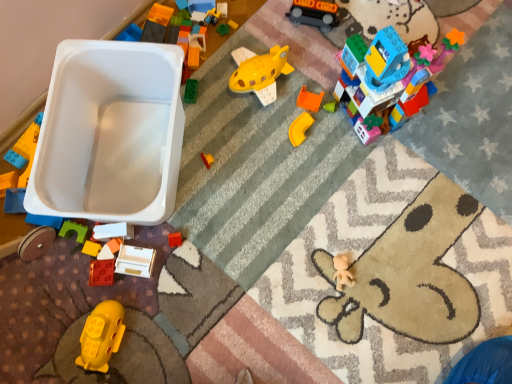
Question: Considering the relative sizes of white plastic toy car at upper left and multicolored plastic building block at upper right, which is the eighth toy in left-to-right order, in the image provided, is white plastic toy car at upper left bigger than multicolored plastic building block at upper right, which is the eighth toy in left-to-right order,?

Choices:
 (A) no
 (B) yes

Answer: (B)

Question: Does white plastic toy car at upper left lie in front of multicolored plastic building block at upper right, which appears as the seventh toy when ordered from the bottom?

Choices:
 (A) no
 (B) yes

Answer: (A)

Question: Is white plastic toy car at upper left wider than multicolored plastic building block at upper right, which appears as the seventh toy when ordered from the bottom?

Choices:
 (A) no
 (B) yes

Answer: (B)

Question: From a real-world perspective, is white plastic toy car at upper left on top of multicolored plastic building block at upper right, which is the eighth toy in left-to-right order?

Choices:
 (A) no
 (B) yes

Answer: (A)

Question: Does white plastic toy car at upper left lie behind multicolored plastic building block at upper right, the first toy when ordered from right to left?

Choices:
 (A) no
 (B) yes

Answer: (B)

Question: From the image's perspective, is white plastic toy car at upper left under multicolored plastic building block at upper right, which appears as the seventh toy when ordered from the bottom?

Choices:
 (A) yes
 (B) no

Answer: (A)

Question: Does rubber brick at lower left, positioned as the seventh toy in right-to-left order, have a smaller size compared to matte white drawer at lower center, positioned as the 4th toy in right-to-left order?

Choices:
 (A) yes
 (B) no

Answer: (A)

Question: Is rubber brick at lower left, the 7th toy positioned from the top, closer to the viewer compared to matte white drawer at lower center, positioned as the 4th toy in right-to-left order?

Choices:
 (A) no
 (B) yes

Answer: (A)

Question: Is rubber brick at lower left, positioned as the seventh toy in right-to-left order, at the left side of matte white drawer at lower center, which is counted as the 5th toy, starting from the left?

Choices:
 (A) no
 (B) yes

Answer: (B)

Question: Is rubber brick at lower left, the 7th toy positioned from the top, wider than matte white drawer at lower center, positioned as the 4th toy in right-to-left order?

Choices:
 (A) no
 (B) yes

Answer: (A)

Question: Considering the relative sizes of rubber brick at lower left, marked as the 2th toy in a left-to-right arrangement, and matte white drawer at lower center, which ranks as the third toy in bottom-to-top order, in the image provided, is rubber brick at lower left, marked as the 2th toy in a left-to-right arrangement, taller than matte white drawer at lower center, which ranks as the third toy in bottom-to-top order,?

Choices:
 (A) no
 (B) yes

Answer: (A)

Question: Is rubber brick at lower left, positioned as the seventh toy in right-to-left order, behind matte white drawer at lower center, the 6th toy from the top?

Choices:
 (A) no
 (B) yes

Answer: (B)

Question: Is matte white drawer at lower center, positioned as the 4th toy in right-to-left order, located outside yellow matte toy submarine at lower left, which is counted as the eighth toy, starting from the top?

Choices:
 (A) no
 (B) yes

Answer: (B)